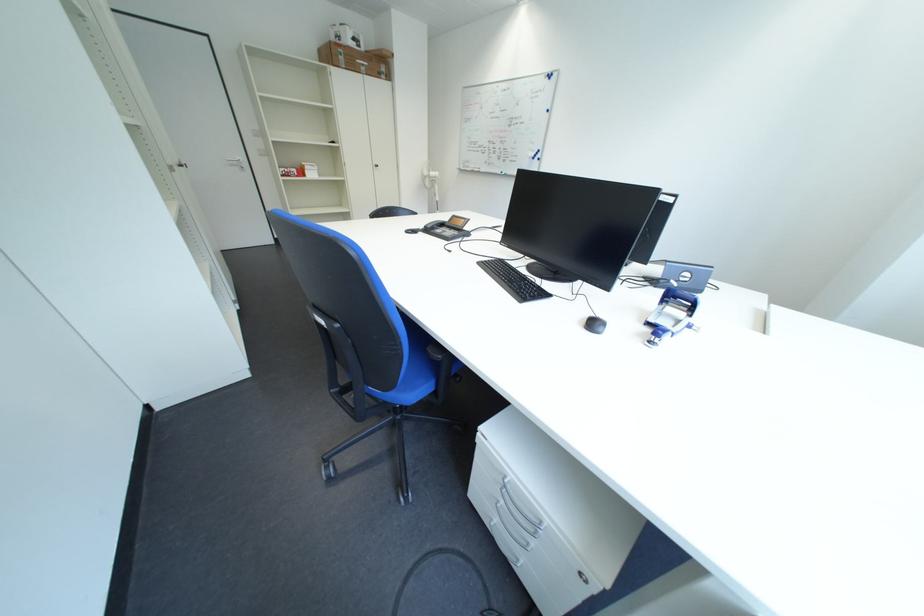
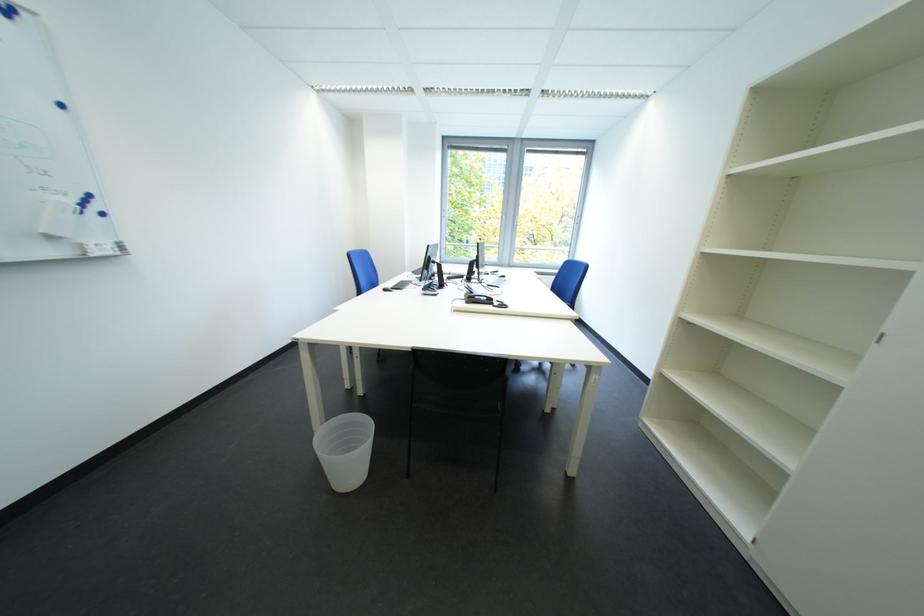
The point at (x=563, y=79) is marked in the first image. Where is the corresponding point in the second image?

(17, 12)